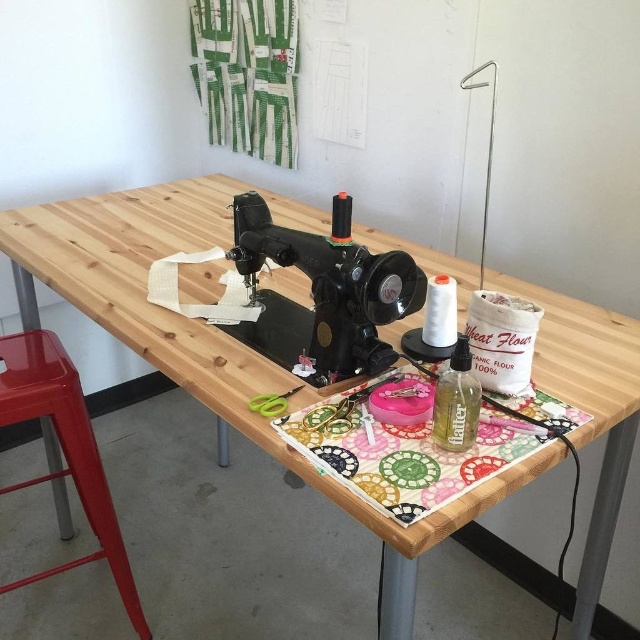
Can you confirm if black metal sewing machine at center is positioned above clear plastic bottle at center?

Indeed, black metal sewing machine at center is positioned over clear plastic bottle at center.

Consider the image. How far apart are black metal sewing machine at center and clear plastic bottle at center?

The distance of black metal sewing machine at center from clear plastic bottle at center is 9.74 inches.

In order to click on black metal sewing machine at center in this screenshot , I will do `click(323, 292)`.

Is clear plastic bottle at center positioned behind green plastic scissors at center?

No, clear plastic bottle at center is closer to the viewer.

Who is shorter, clear plastic bottle at center or green plastic scissors at center?

green plastic scissors at center

Find the location of a particular element. clear plastic bottle at center is located at coordinates click(x=456, y=401).

The width and height of the screenshot is (640, 640). I want to click on clear plastic bottle at center, so click(x=456, y=401).

From the picture: Can you confirm if black metal sewing machine at center is positioned to the left of metallic red stool at lower left?

No, black metal sewing machine at center is not to the left of metallic red stool at lower left.

Describe the element at coordinates (323, 292) in the screenshot. Image resolution: width=640 pixels, height=640 pixels. I see `black metal sewing machine at center` at that location.

Identify the location of black metal sewing machine at center. (323, 292).